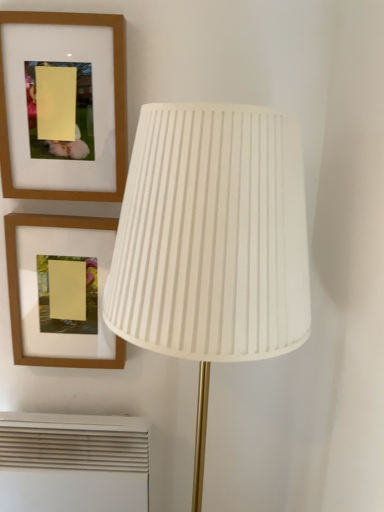
Question: Can you confirm if wooden frame at upper left, the first picture frame when ordered from top to bottom, is thinner than wooden picture frame at upper left, arranged as the second picture frame when viewed from the top?

Choices:
 (A) yes
 (B) no

Answer: (A)

Question: Could wooden picture frame at upper left, arranged as the second picture frame when viewed from the top, be considered to be inside wooden frame at upper left, which ranks as the second picture frame in bottom-to-top order?

Choices:
 (A) yes
 (B) no

Answer: (B)

Question: Considering the relative sizes of wooden frame at upper left, which ranks as the second picture frame in bottom-to-top order, and wooden picture frame at upper left, the first picture frame in the bottom-to-top sequence, in the image provided, is wooden frame at upper left, which ranks as the second picture frame in bottom-to-top order, smaller than wooden picture frame at upper left, the first picture frame in the bottom-to-top sequence,?

Choices:
 (A) no
 (B) yes

Answer: (B)

Question: From the image's perspective, is wooden frame at upper left, the first picture frame when ordered from top to bottom, beneath wooden picture frame at upper left, the first picture frame in the bottom-to-top sequence?

Choices:
 (A) no
 (B) yes

Answer: (A)

Question: Does wooden frame at upper left, the first picture frame when ordered from top to bottom, have a larger size compared to wooden picture frame at upper left, the first picture frame in the bottom-to-top sequence?

Choices:
 (A) no
 (B) yes

Answer: (A)

Question: Relative to wooden picture frame at upper left, the first picture frame in the bottom-to-top sequence, is wooden frame at upper left, which ranks as the second picture frame in bottom-to-top order, in front or behind?

Choices:
 (A) front
 (B) behind

Answer: (A)

Question: In terms of size, does wooden frame at upper left, which ranks as the second picture frame in bottom-to-top order, appear bigger or smaller than wooden picture frame at upper left, arranged as the second picture frame when viewed from the top?

Choices:
 (A) small
 (B) big

Answer: (A)

Question: From the image's perspective, is wooden frame at upper left, which ranks as the second picture frame in bottom-to-top order, positioned above or below wooden picture frame at upper left, the first picture frame in the bottom-to-top sequence?

Choices:
 (A) below
 (B) above

Answer: (B)

Question: Is wooden frame at upper left, which ranks as the second picture frame in bottom-to-top order, spatially inside wooden picture frame at upper left, arranged as the second picture frame when viewed from the top, or outside of it?

Choices:
 (A) inside
 (B) outside

Answer: (B)

Question: From the image's perspective, is white pleated fabric lampshade at center positioned above or below wooden picture frame at upper left, arranged as the second picture frame when viewed from the top?

Choices:
 (A) below
 (B) above

Answer: (A)

Question: Is white pleated fabric lampshade at center wider or thinner than wooden picture frame at upper left, arranged as the second picture frame when viewed from the top?

Choices:
 (A) thin
 (B) wide

Answer: (B)

Question: Is point (248, 280) closer or farther from the camera than point (94, 224)?

Choices:
 (A) closer
 (B) farther

Answer: (A)

Question: Relative to wooden picture frame at upper left, the first picture frame in the bottom-to-top sequence, is white pleated fabric lampshade at center in front or behind?

Choices:
 (A) behind
 (B) front

Answer: (B)

Question: Considering the positions of point (49, 224) and point (157, 278), is point (49, 224) closer or farther from the camera than point (157, 278)?

Choices:
 (A) farther
 (B) closer

Answer: (A)

Question: In the image, is wooden picture frame at upper left, the first picture frame in the bottom-to-top sequence, on the left side or the right side of white pleated fabric lampshade at center?

Choices:
 (A) right
 (B) left

Answer: (B)